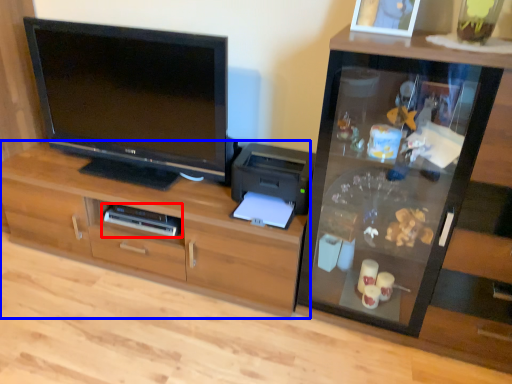
Question: Which point is closer to the camera, home appliance (highlighted by a red box) or cabinetry (highlighted by a blue box)?

Choices:
 (A) home appliance
 (B) cabinetry

Answer: (B)